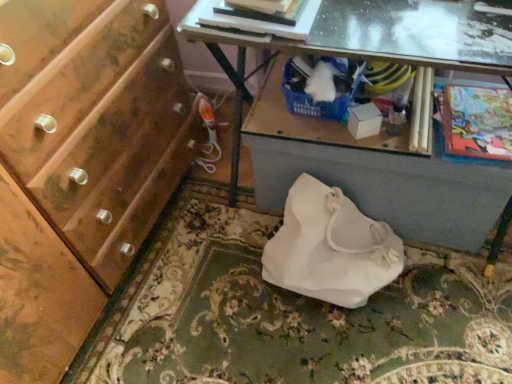
What are the coordinates of `free space above transparent glass table at upper center (from a real-world perspective)` in the screenshot? It's located at (426, 20).